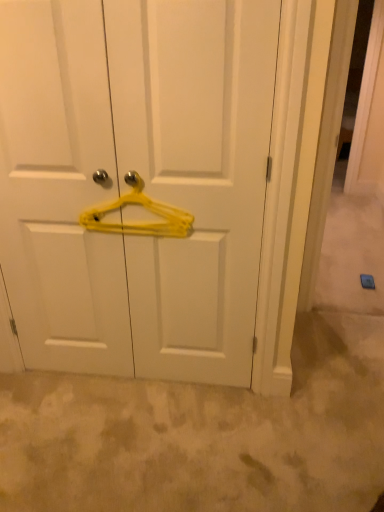
Question: Would you say yellow plastic hanger at center is part of yellow plastic hanger at center's contents?

Choices:
 (A) yes
 (B) no

Answer: (B)

Question: Is yellow plastic hanger at center facing away from yellow plastic hanger at center?

Choices:
 (A) yes
 (B) no

Answer: (A)

Question: Does yellow plastic hanger at center have a smaller size compared to yellow plastic hanger at center?

Choices:
 (A) no
 (B) yes

Answer: (B)

Question: Is yellow plastic hanger at center in contact with yellow plastic hanger at center?

Choices:
 (A) no
 (B) yes

Answer: (A)

Question: Does yellow plastic hanger at center have a larger size compared to yellow plastic hanger at center?

Choices:
 (A) yes
 (B) no

Answer: (B)

Question: From a real-world perspective, is yellow plastic hanger at center on top of yellow plastic hanger at center?

Choices:
 (A) no
 (B) yes

Answer: (B)

Question: Is yellow plastic hanger at center turned away from yellow plastic hanger at center?

Choices:
 (A) no
 (B) yes

Answer: (B)

Question: Does yellow plastic hanger at center have a lesser height compared to yellow plastic hanger at center?

Choices:
 (A) yes
 (B) no

Answer: (B)

Question: Considering the relative sizes of yellow plastic hanger at center and yellow plastic hanger at center in the image provided, is yellow plastic hanger at center smaller than yellow plastic hanger at center?

Choices:
 (A) yes
 (B) no

Answer: (B)

Question: Considering the relative positions of yellow plastic hanger at center and yellow plastic hanger at center in the image provided, is yellow plastic hanger at center behind yellow plastic hanger at center?

Choices:
 (A) yes
 (B) no

Answer: (B)

Question: Is yellow plastic hanger at center surrounded by yellow plastic hanger at center?

Choices:
 (A) no
 (B) yes

Answer: (B)

Question: From a real-world perspective, is yellow plastic hanger at center physically below yellow plastic hanger at center?

Choices:
 (A) no
 (B) yes

Answer: (B)

Question: Choose the correct answer: Is yellow plastic hanger at center inside yellow plastic hanger at center or outside it?

Choices:
 (A) outside
 (B) inside

Answer: (B)